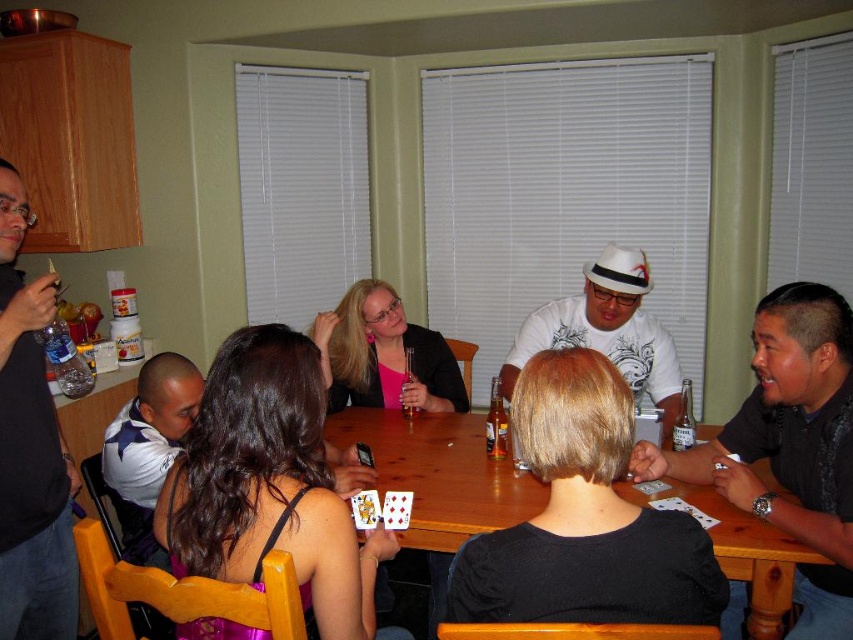
Does black shirt at right have a greater width compared to white matte shirt at center?

No, black shirt at right is not wider than white matte shirt at center.

Is point (828, 406) positioned before point (555, 308)?

Yes, it is in front of point (555, 308).

I want to click on black shirt at right, so (790, 445).

The image size is (853, 640). What do you see at coordinates (440, 474) in the screenshot? I see `wooden table at center` at bounding box center [440, 474].

Can you confirm if wooden table at center is positioned below black matte shirt at left?

Correct, wooden table at center is located below black matte shirt at left.

This screenshot has width=853, height=640. What are the coordinates of `wooden table at center` in the screenshot? It's located at (440, 474).

Which is more to the left, black shirt at right or white shirt at left?

white shirt at left

Is point (772, 301) farther from viewer compared to point (117, 428)?

No, (772, 301) is in front of (117, 428).

This screenshot has width=853, height=640. Identify the location of black shirt at right. (790, 445).